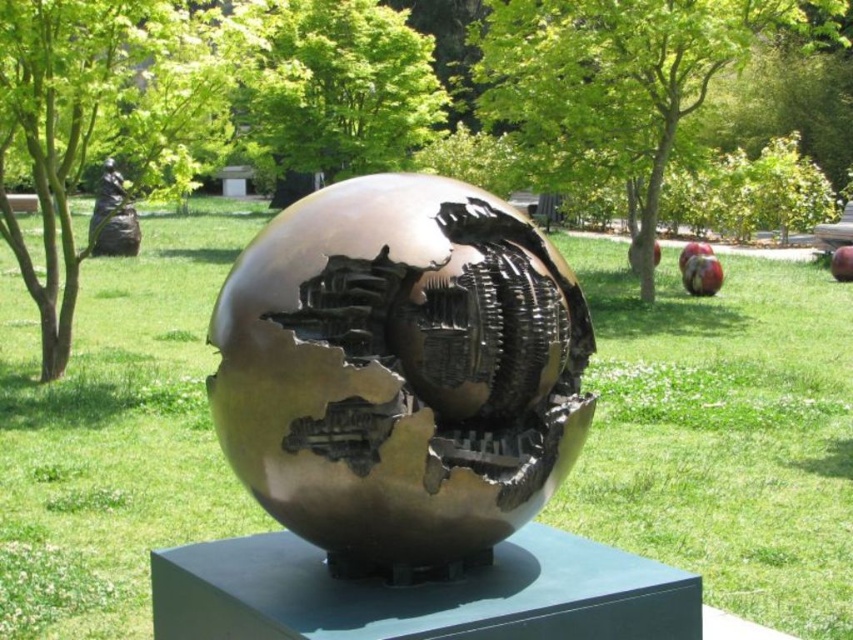
In the scene shown: Which is above, bronze metallic sphere at center or black matte statue at upper left?

black matte statue at upper left is higher up.

Between point (296, 474) and point (97, 244), which one is positioned in front?

Point (296, 474) is more forward.

Looking at this image, who is more forward, (x=419, y=305) or (x=135, y=248)?

Point (x=419, y=305) is more forward.

At what (x,y) coordinates should I click in order to perform the action: click on bronze metallic sphere at center. Please return your answer as a coordinate pair (x, y). Looking at the image, I should click on (399, 371).